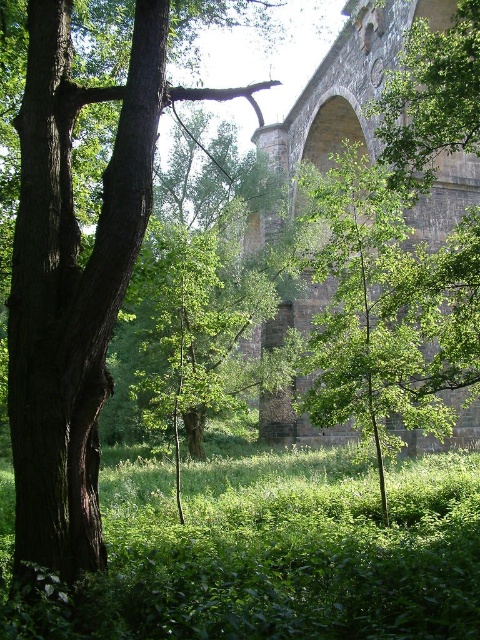
Between green leafy grass at center and dark brown bark tree at left, which one has less height?

Standing shorter between the two is green leafy grass at center.

Is green leafy grass at center to the right of dark brown bark tree at left from the viewer's perspective?

Indeed, green leafy grass at center is positioned on the right side of dark brown bark tree at left.

Identify the location of green leafy grass at center. Image resolution: width=480 pixels, height=640 pixels. (278, 554).

Identify the location of green leafy grass at center. This screenshot has height=640, width=480. (278, 554).

Does green leafy grass at center have a smaller size compared to stone arch bridge at center?

Correct, green leafy grass at center occupies less space than stone arch bridge at center.

Which of these two, green leafy grass at center or stone arch bridge at center, stands shorter?

With less height is green leafy grass at center.

Between point (432, 513) and point (457, 397), which one is positioned behind?

The point (457, 397) is behind.

This screenshot has height=640, width=480. I want to click on green leafy grass at center, so click(x=278, y=554).

Can you confirm if dark brown bark tree at left is positioned below stone arch bridge at center?

Correct, dark brown bark tree at left is located below stone arch bridge at center.

Can you confirm if dark brown bark tree at left is bigger than stone arch bridge at center?

Actually, dark brown bark tree at left might be smaller than stone arch bridge at center.

Does point (57, 436) come closer to viewer compared to point (295, 304)?

Yes, it is in front of point (295, 304).

Locate an element on the screen. dark brown bark tree at left is located at coordinates (74, 282).